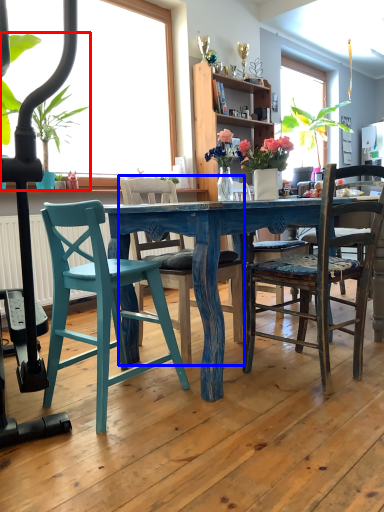
Question: Among these objects, which one is nearest to the camera, houseplant (highlighted by a red box) or chair (highlighted by a blue box)?

Choices:
 (A) houseplant
 (B) chair

Answer: (B)